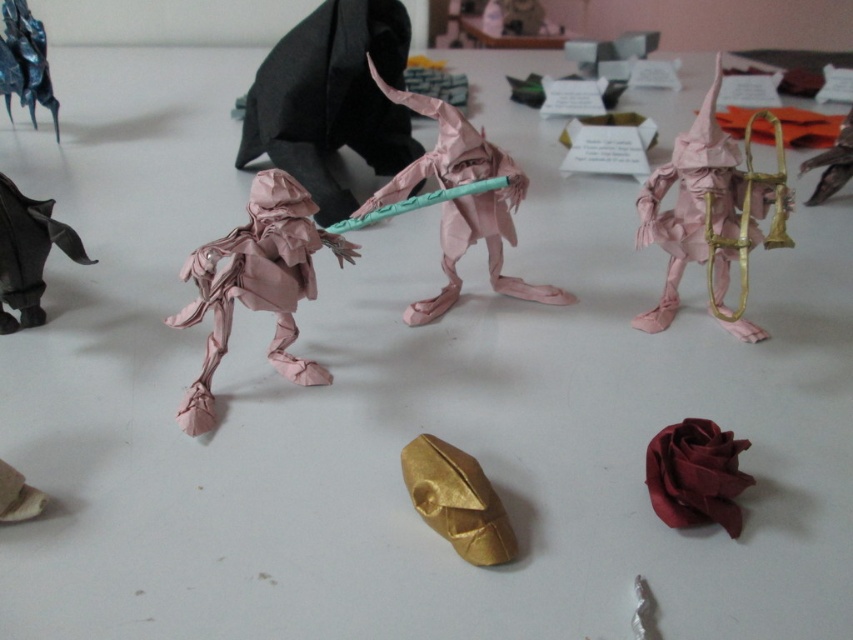
Is pink paper wizard at upper right closer to the viewer compared to matte red paper rose at lower right?

No, pink paper wizard at upper right is behind matte red paper rose at lower right.

In the scene shown: Who is more forward, [766,189] or [698,513]?

Point [698,513] is in front.

Find the location of a particular element. The height and width of the screenshot is (640, 853). pink paper wizard at upper right is located at coordinates (708, 216).

From the picture: Does pink paper creature at center-left appear over gold metallic helmet at center?

Yes, pink paper creature at center-left is above gold metallic helmet at center.

Who is higher up, pink paper creature at center-left or gold metallic helmet at center?

pink paper creature at center-left

Does point (213, 308) come closer to viewer compared to point (511, 552)?

No, (213, 308) is further to viewer.

Locate an element on the screen. The image size is (853, 640). pink paper creature at center-left is located at coordinates (256, 284).

Does matte pink paper at center appear under pink paper wizard at upper right?

No.

Who is shorter, matte pink paper at center or pink paper wizard at upper right?

pink paper wizard at upper right

Between point (312, 102) and point (688, 198), which one is positioned in front?

Point (688, 198) is more forward.

Identify the location of matte pink paper at center. The width and height of the screenshot is (853, 640). (331, 99).